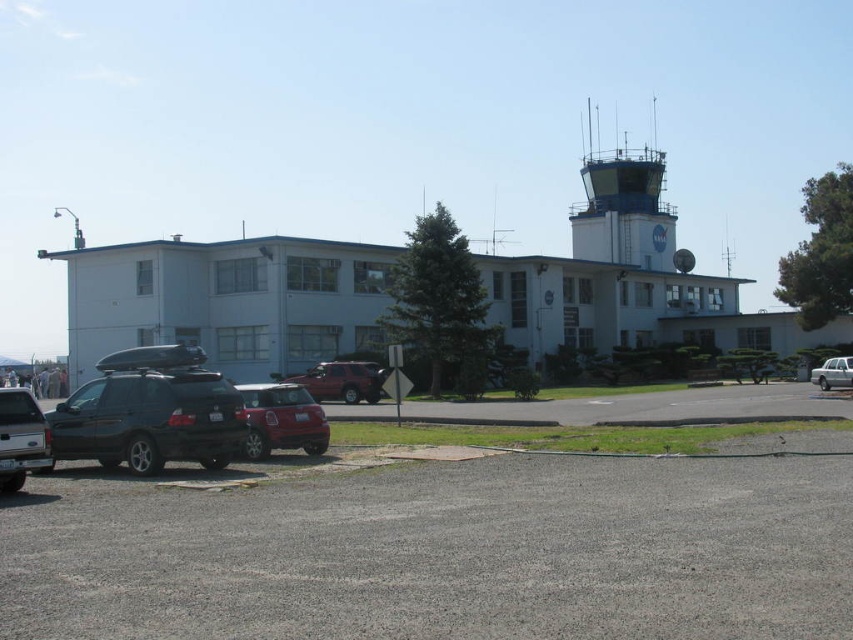
Question: Which of the following is the farthest from the observer?

Choices:
 (A) click(x=833, y=572)
 (B) click(x=596, y=134)
 (C) click(x=830, y=371)

Answer: (B)

Question: Where is black matte suv at lower left located in relation to smooth gray control tower at upper right in the image?

Choices:
 (A) left
 (B) right

Answer: (A)

Question: Which object is the closest to the black matte suv at lower left?

Choices:
 (A) gray asphalt parking lot at lower center
 (B) shiny red car at center

Answer: (B)

Question: Which point appears closest to the camera in this image?

Choices:
 (A) (55, 604)
 (B) (276, 387)

Answer: (A)

Question: Does black matte suv at lower left come in front of white metallic sedan at lower right?

Choices:
 (A) no
 (B) yes

Answer: (B)

Question: Is gray asphalt parking lot at lower center to the right of matte black truck at lower left from the viewer's perspective?

Choices:
 (A) yes
 (B) no

Answer: (A)